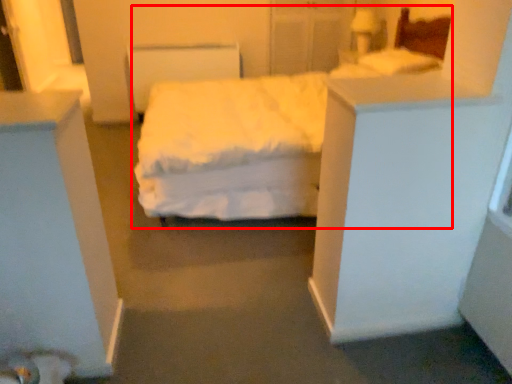
Question: From the image's perspective, what is the correct spatial positioning of bed (annotated by the red box) in reference to pillow?

Choices:
 (A) above
 (B) below

Answer: (B)